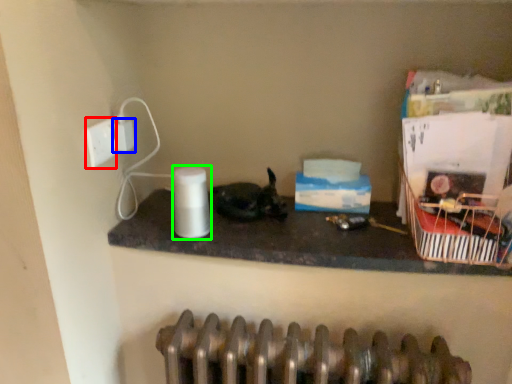
Question: Which object is the closest to the socket (highlighted by a red box)? Choose among these: electric outlet (highlighted by a blue box) or paper towel (highlighted by a green box).

Choices:
 (A) electric outlet
 (B) paper towel

Answer: (A)